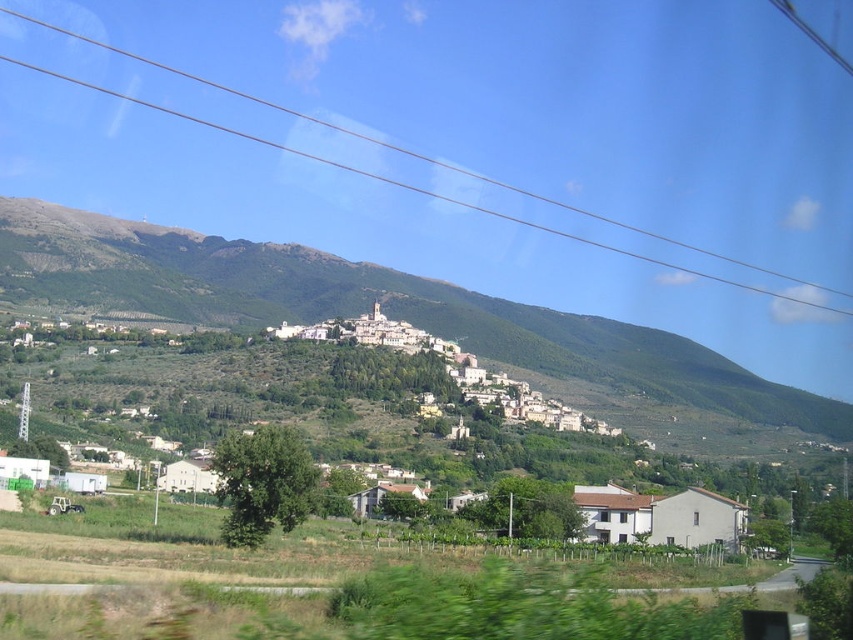
Question: Which of these objects is positioned closest to the white stone village at center?

Choices:
 (A) transparent glass power lines at upper center
 (B) green grassy hillside at upper center

Answer: (B)

Question: Which point appears closest to the camera in this image?

Choices:
 (A) (718, 256)
 (B) (111, 292)

Answer: (B)

Question: From the image, what is the correct spatial relationship of green grassy hillside at upper center in relation to transparent glass power lines at upper center?

Choices:
 (A) left
 (B) right

Answer: (A)

Question: Does green grassy hillside at upper center have a larger size compared to white stone village at center?

Choices:
 (A) yes
 (B) no

Answer: (A)

Question: Which point is farther from the camera taking this photo?

Choices:
 (A) (708, 371)
 (B) (593, 420)
 (C) (303, 118)

Answer: (C)

Question: Is white stone village at center positioned before transparent glass power lines at upper center?

Choices:
 (A) no
 (B) yes

Answer: (B)